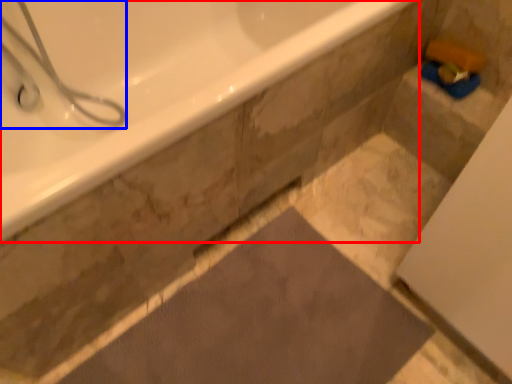
Question: Which point is closer to the camera, bathtub (highlighted by a red box) or shower (highlighted by a blue box)?

Choices:
 (A) bathtub
 (B) shower

Answer: (A)